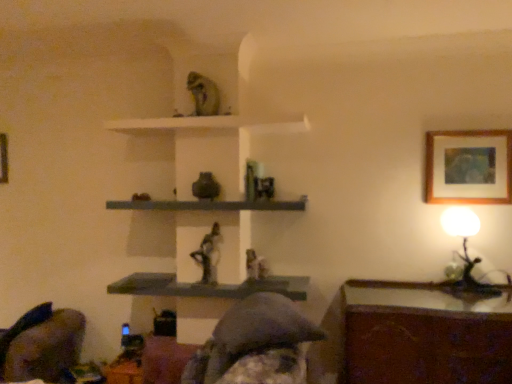
Question: From the image's perspective, is wooden framed artwork at upper right, which ranks as the second picture frame in left-to-right order, located above or below white glossy table lamp at right?

Choices:
 (A) below
 (B) above

Answer: (B)

Question: From a real-world perspective, is wooden framed artwork at upper right, which ranks as the second picture frame in back-to-front order, above or below white glossy table lamp at right?

Choices:
 (A) below
 (B) above

Answer: (B)

Question: Estimate the real-world distances between objects in this image. Which object is farther from the velvet dark gray swivel chair at lower left?

Choices:
 (A) white glossy table lamp at right
 (B) white matte shelf at upper center, marked as the 3th shelf in a bottom-to-top arrangement
 (C) wooden picture frame at upper left, the first picture frame positioned from the left
 (D) matte gray statue at center, the second person in the front-to-back sequence
 (E) matte gray shelf at center, positioned as the first shelf in bottom-to-top order

Answer: (A)

Question: Based on their relative distances, which object is nearer to the white matte shelf at upper center, marked as the 3th shelf in a bottom-to-top arrangement?

Choices:
 (A) matte gray statue at center, placed as the first person when sorted from back to front
 (B) matte gray statue at center, positioned as the first person in front-to-back order
 (C) white glossy table lamp at right
 (D) smooth gray shelf at center, placed as the second shelf when sorted from bottom to top
 (E) wooden framed artwork at upper right, which ranks as the second picture frame in back-to-front order

Answer: (D)